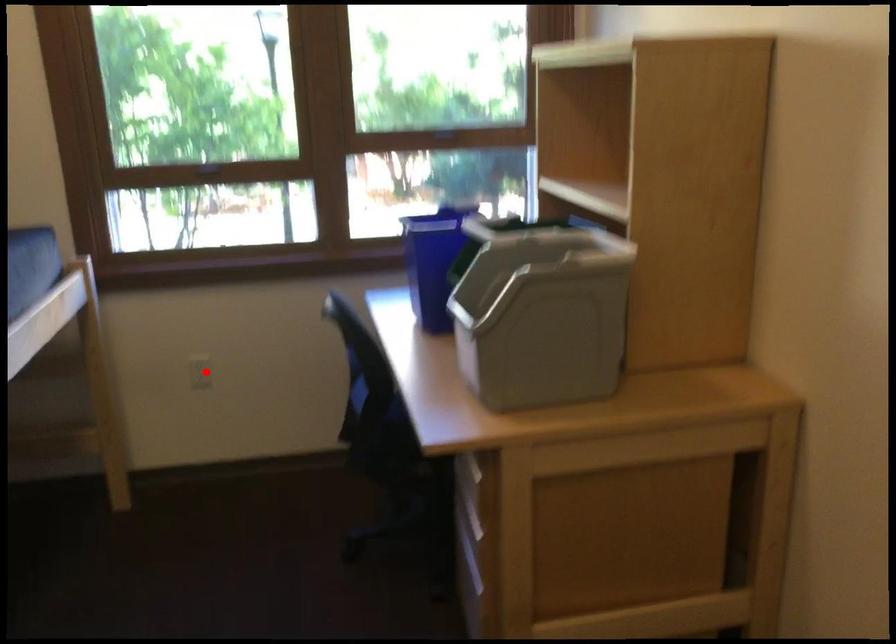
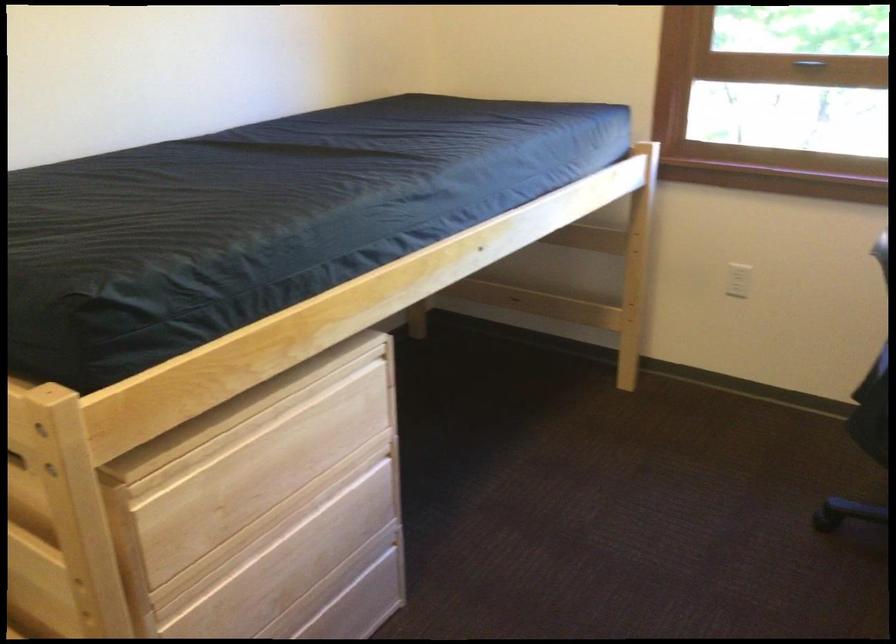
In the second image, find the point that corresponds to the highlighted location in the first image.

(738, 279)